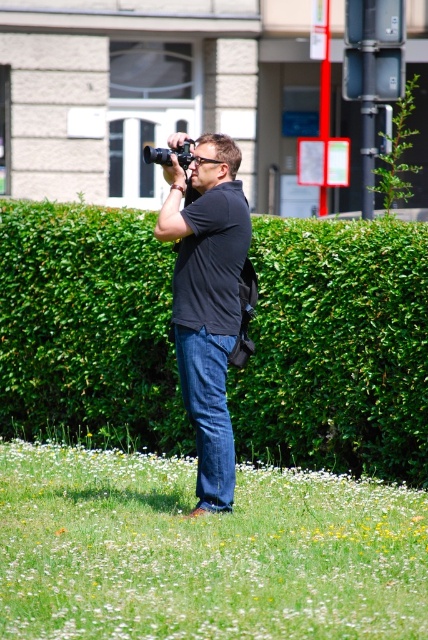
Question: Which object is positioned closest to the black matte shirt at center?

Choices:
 (A) green leafy hedge at center
 (B) green grass at lower center
 (C) black plastic camera at center

Answer: (C)

Question: Is green grass at lower center positioned behind black plastic camera at center?

Choices:
 (A) yes
 (B) no

Answer: (B)

Question: Can you confirm if green leafy hedge at center is smaller than black plastic camera at center?

Choices:
 (A) yes
 (B) no

Answer: (A)

Question: Which object appears closest to the camera in this image?

Choices:
 (A) black matte shirt at center
 (B) green leafy hedge at center
 (C) black plastic camera at center
 (D) green grass at lower center

Answer: (D)

Question: Which of the following is the farthest from the observer?

Choices:
 (A) (142, 157)
 (B) (193, 170)
 (C) (276, 582)
 (D) (139, 413)

Answer: (A)

Question: Does green leafy hedge at center have a smaller size compared to black matte shirt at center?

Choices:
 (A) no
 (B) yes

Answer: (A)